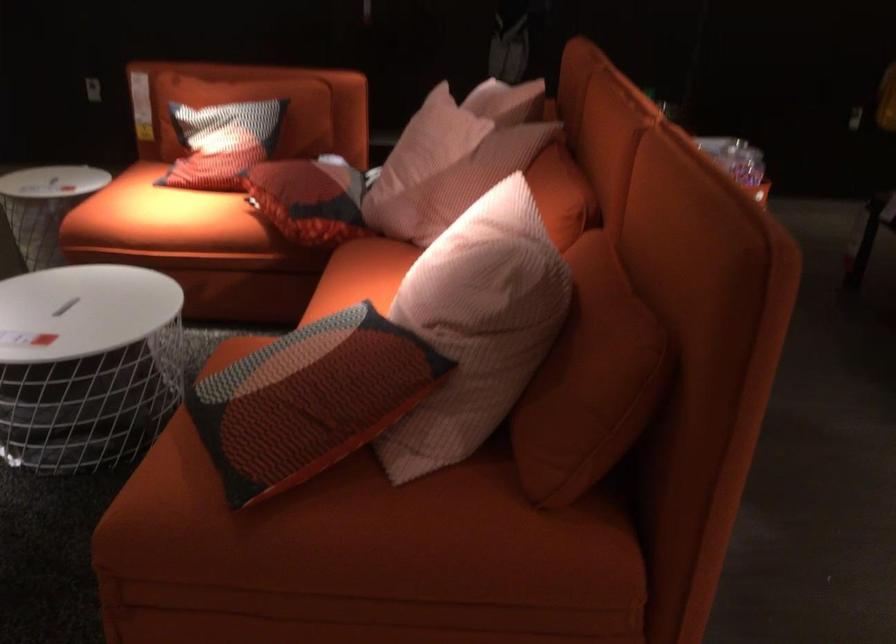
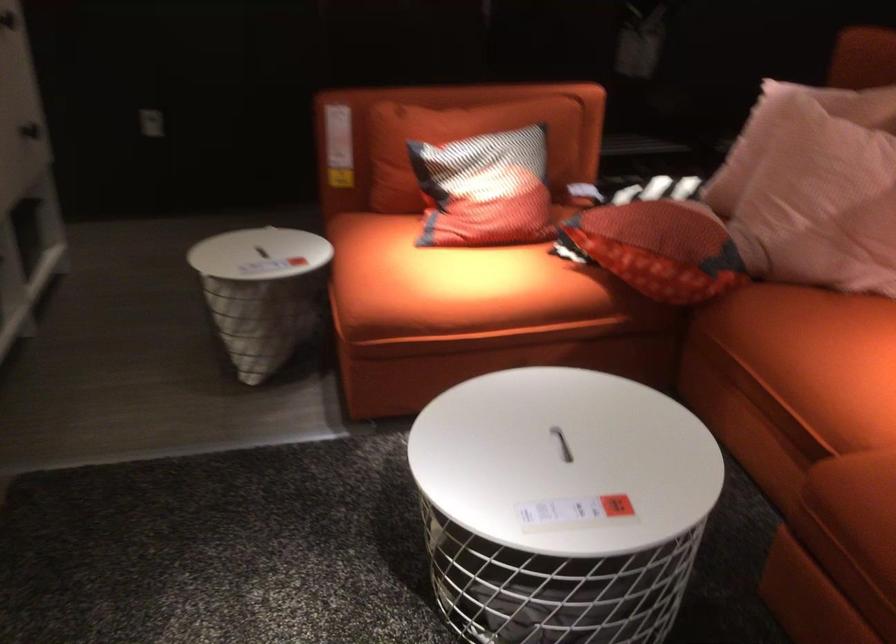
Where in the second image is the point corresponding to (x=280, y=201) from the first image?

(659, 248)